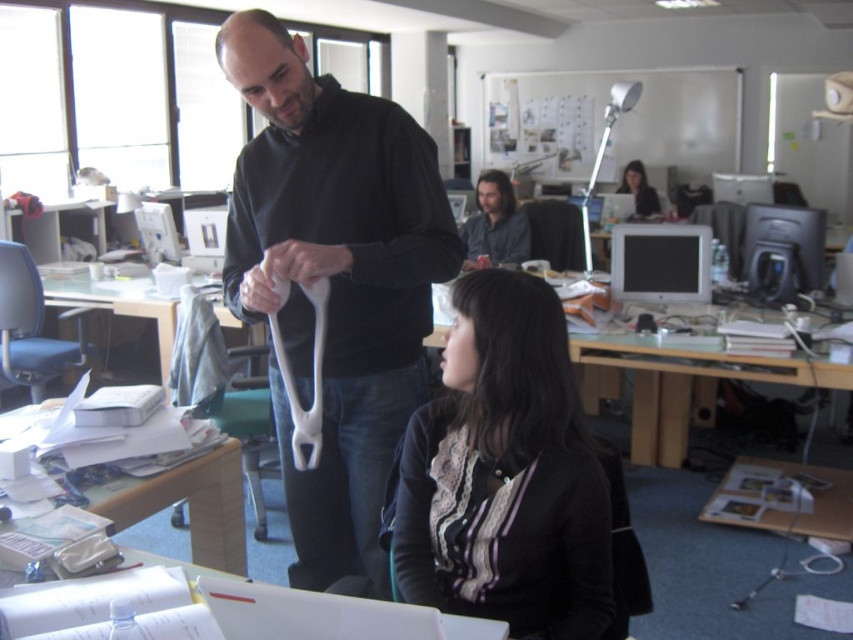
Consider the image. You are a delivery robot with a 1.5 meter reach. You need to place a package on the black matte sweater at center. Can you reach it?

The black matte sweater at center is 1.57 meters away from the camera, so the delivery robot cannot reach it with a 1.5 meter reach.

You are a delivery robot with a height of 1.6 meters. You are positioned at point (351, 310) in the office and need to move towards the camera. Is there enough vertical clearance for you to move safely?

The distance between point (351, 310) and the camera is 1.76 meters. Since the robot is 1.6 meters tall, there is sufficient vertical clearance for it to move safely towards the camera.